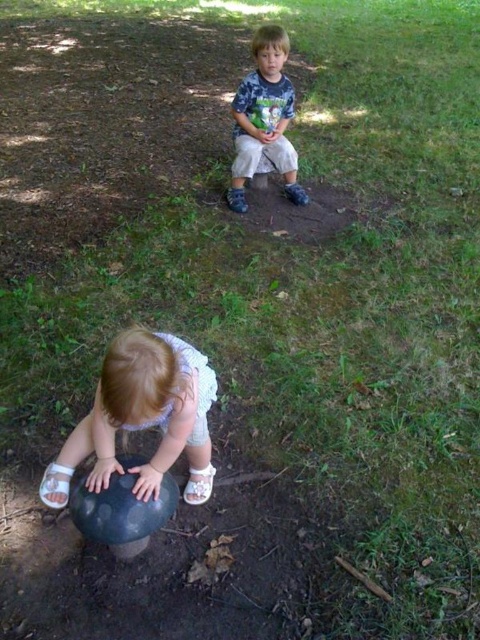
You are a photographer setting up a shot of the two children in the park. You want to ensure the smooth white sand at lower left is visible in the foreground without being blocked by the matte blue shirt at upper center. Based on their positions, is this possible?

The smooth white sand at lower left is positioned under the matte blue shirt at upper center, so part of the sand might be obscured by the shirt. Adjust the camera angle to capture the sand without obstruction.

Based on the scene description, where is the smooth white sand at lower left located in the image?

The smooth white sand at lower left is located at the 2D coordinates point [143,417] in the image.